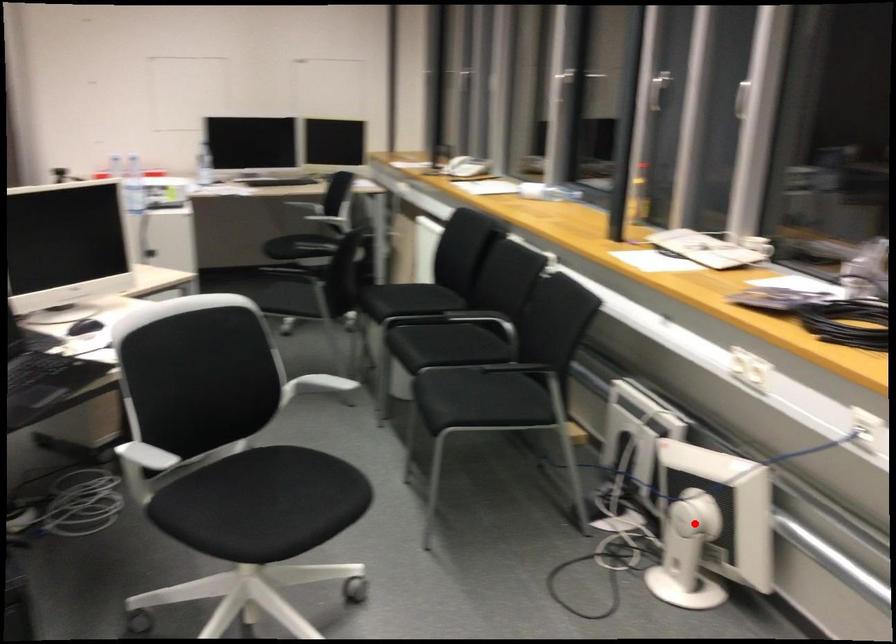
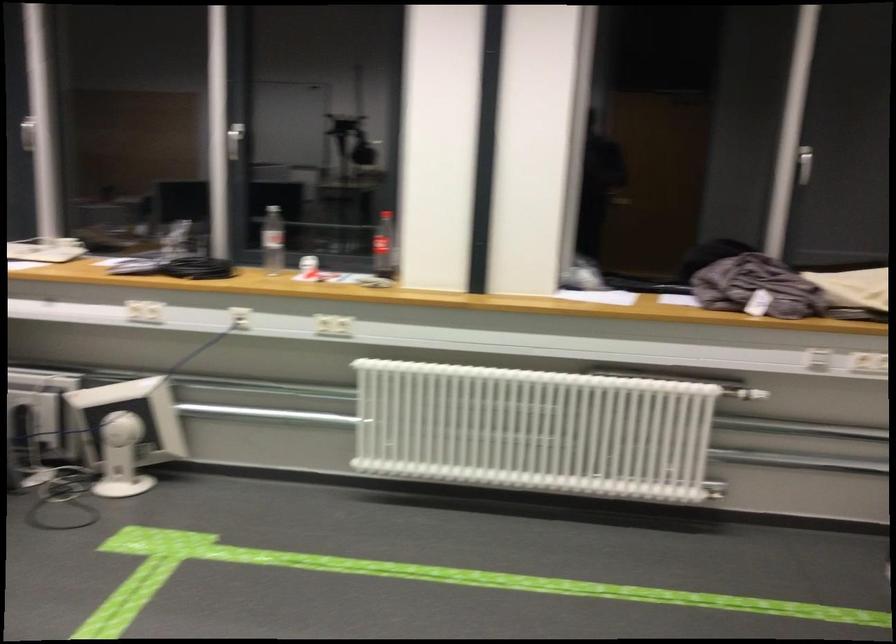
Question: A red point is marked in image1. In image2, is the corresponding 3D point closer to the camera or farther? Reply with the corresponding letter.

Choices:
 (A) The corresponding 3D point is closer.
 (B) The corresponding 3D point is farther.

Answer: (B)